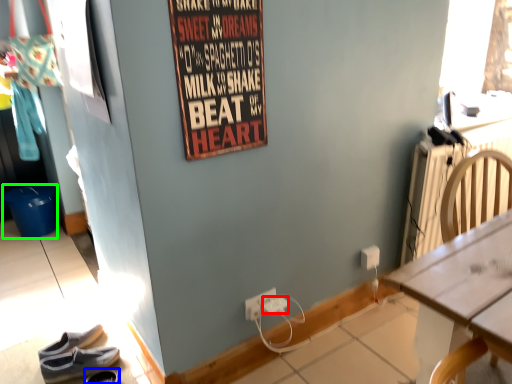
Question: Estimate the real-world distances between objects in this image. Which object is closer to power outlet (highlighted by a red box), footwear (highlighted by a blue box) or bucket (highlighted by a green box)?

Choices:
 (A) footwear
 (B) bucket

Answer: (A)